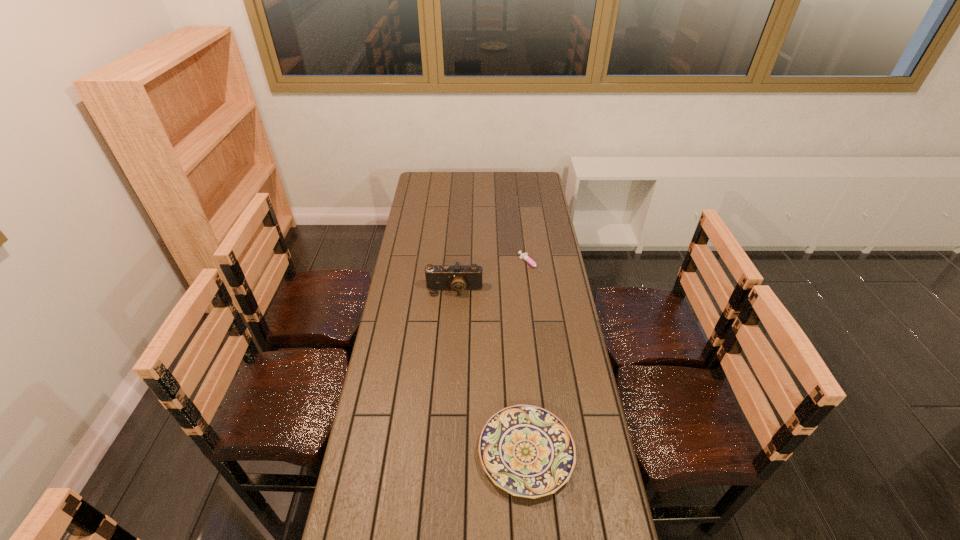
I want to click on free spot at the far edge of the desktop, so click(496, 193).

At what (x,y) coordinates should I click in order to perform the action: click on vacant region at the left edge of the desktop. Please return your answer as a coordinate pair (x, y). Looking at the image, I should click on (363, 519).

Image resolution: width=960 pixels, height=540 pixels. In order to click on free point at the right edge in this screenshot , I will do `click(543, 208)`.

This screenshot has height=540, width=960. In order to click on empty space that is in between the nearest object and the camera in this screenshot , I will do `click(491, 371)`.

The height and width of the screenshot is (540, 960). I want to click on vacant point located between the nearest object and the syringe, so click(x=529, y=359).

Image resolution: width=960 pixels, height=540 pixels. In order to click on free spot between the farthest object and the second farthest object in this screenshot , I will do `click(492, 277)`.

I want to click on unoccupied position between the plate and the syringe, so click(x=529, y=359).

You are a GUI agent. You are given a task and a screenshot of the screen. Output one action in this format:
    pyautogui.click(x=<x>, y=<y>)
    Task: Click on the free spot between the plate and the tallest object
    The image size is (960, 540).
    Given the screenshot: What is the action you would take?
    pyautogui.click(x=491, y=371)

The height and width of the screenshot is (540, 960). Find the location of `free point between the syringe and the nearest object`. free point between the syringe and the nearest object is located at coordinates click(529, 359).

At what (x,y) coordinates should I click in order to perform the action: click on object that is the closest to the tallest object. Please return your answer as a coordinate pair (x, y). The width and height of the screenshot is (960, 540). Looking at the image, I should click on (524, 256).